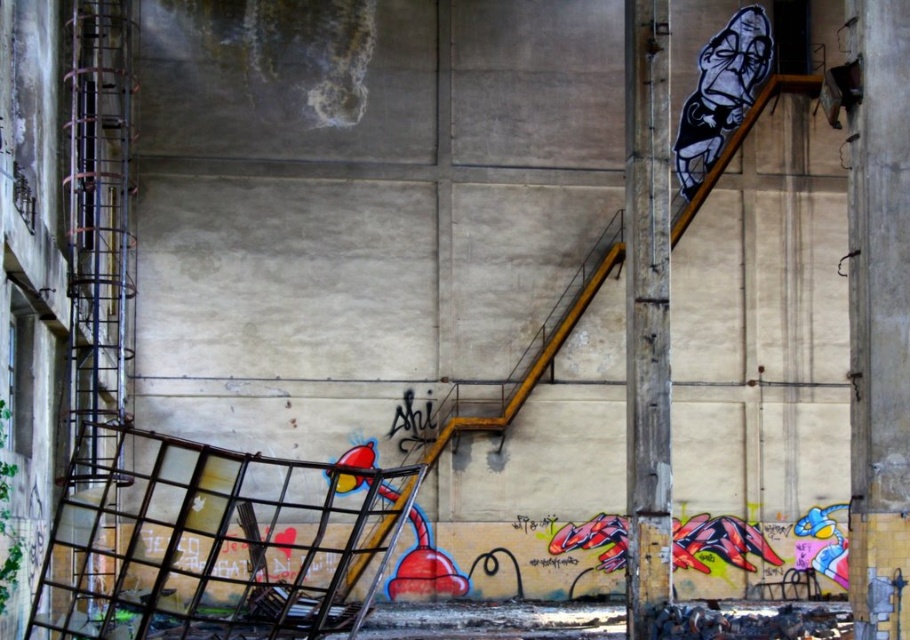
Question: Which of the following is the farthest from the observer?

Choices:
 (A) (660, 51)
 (B) (678, 122)

Answer: (B)

Question: Which of the following is the farthest from the observer?

Choices:
 (A) black and white graffiti at upper right
 (B) rusty metal pole at right

Answer: (A)

Question: Which point is closer to the camera?

Choices:
 (A) coord(642,508)
 (B) coord(728,100)

Answer: (A)

Question: Is rusty metal pole at right to the right of black and white graffiti at upper right from the viewer's perspective?

Choices:
 (A) no
 (B) yes

Answer: (A)

Question: Can you confirm if rusty metal pole at right is positioned above black and white graffiti at upper right?

Choices:
 (A) no
 (B) yes

Answer: (A)

Question: Can you confirm if rusty metal pole at right is wider than black and white graffiti at upper right?

Choices:
 (A) no
 (B) yes

Answer: (A)